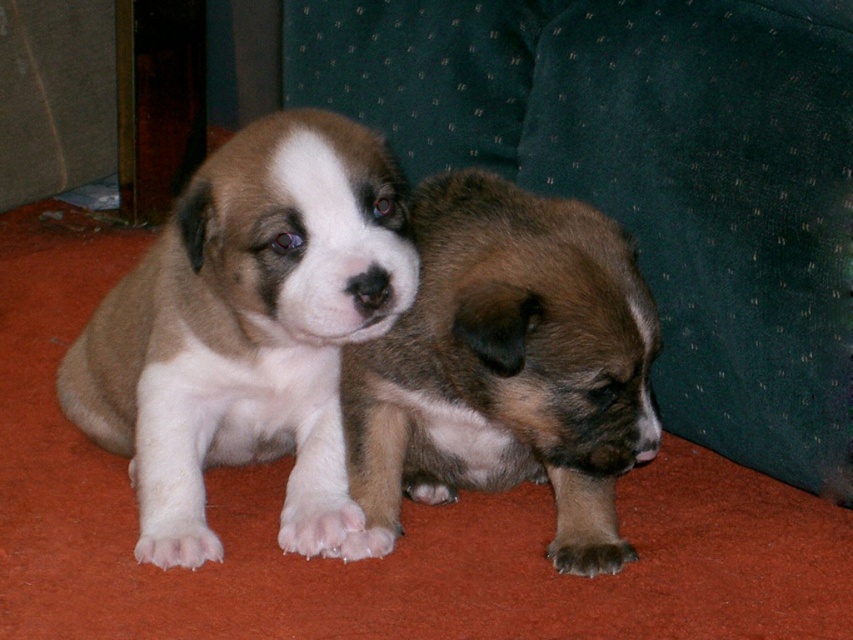
Question: Does soft brown fur puppy at center appear under brown fuzzy puppy at center?

Choices:
 (A) yes
 (B) no

Answer: (B)

Question: Can you confirm if soft brown fur puppy at center is positioned to the left of brown fuzzy puppy at center?

Choices:
 (A) no
 (B) yes

Answer: (B)

Question: Which point is farther from the camera taking this photo?

Choices:
 (A) (404, 241)
 (B) (396, 330)

Answer: (B)

Question: Which point is closer to the camera?

Choices:
 (A) (277, 314)
 (B) (605, 548)

Answer: (A)

Question: Which point appears farthest from the camera in this image?

Choices:
 (A) (144, 454)
 (B) (474, 237)

Answer: (A)

Question: Observing the image, what is the correct spatial positioning of soft brown fur puppy at center in reference to brown fuzzy puppy at center?

Choices:
 (A) below
 (B) above

Answer: (B)